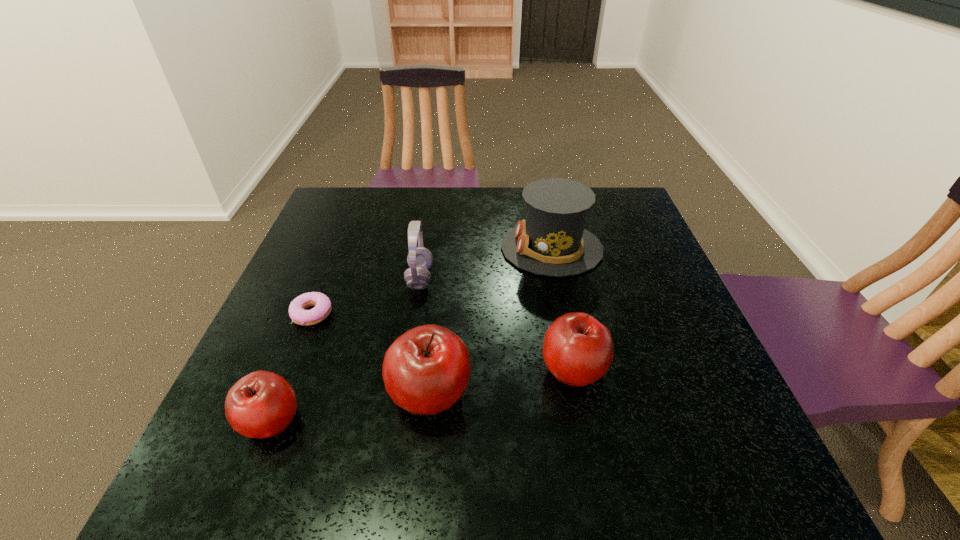
This screenshot has width=960, height=540. Find the location of `free point located on the left of the rightmost apple`. free point located on the left of the rightmost apple is located at coordinates (402, 369).

Where is `free region located 0.120m on the headband and ear cups of the headset`? This screenshot has width=960, height=540. free region located 0.120m on the headband and ear cups of the headset is located at coordinates (481, 278).

Where is `vacant space positioned 0.210m with goggles on the front of the dress hat`? The height and width of the screenshot is (540, 960). vacant space positioned 0.210m with goggles on the front of the dress hat is located at coordinates (423, 248).

At what (x,y) coordinates should I click in order to perform the action: click on vacant space positioned with goggles on the front of the dress hat. Please return your answer as a coordinate pair (x, y). The width and height of the screenshot is (960, 540). Looking at the image, I should click on (369, 248).

The width and height of the screenshot is (960, 540). I want to click on vacant space situated 0.100m with goggles on the front of the dress hat, so click(x=464, y=248).

Where is `free space located on the right of the third farthest object`? This screenshot has height=540, width=960. free space located on the right of the third farthest object is located at coordinates (415, 314).

Locate an element on the screen. object that is at the far edge is located at coordinates (552, 240).

Locate an element on the screen. Image resolution: width=960 pixels, height=540 pixels. apple that is at the left edge is located at coordinates (262, 404).

Locate an element on the screen. Image resolution: width=960 pixels, height=540 pixels. doughnut located in the left edge section of the desktop is located at coordinates (298, 314).

Identify the location of object located at the right edge. The image size is (960, 540). (552, 240).